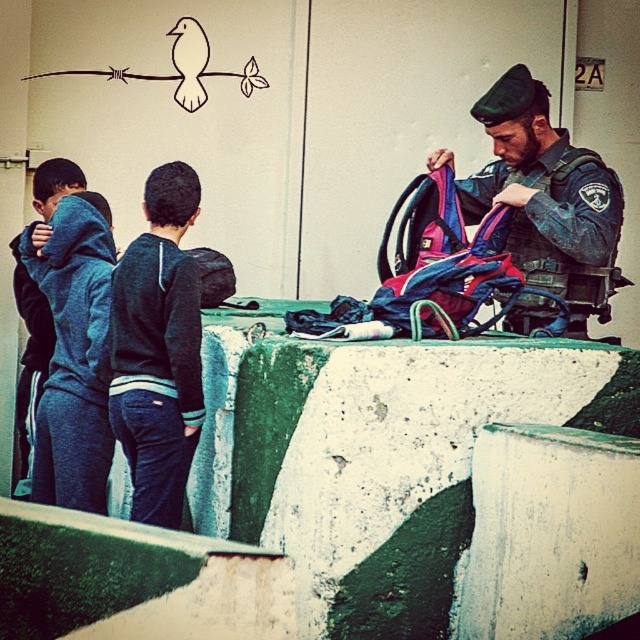
Who is taller, dark gray hoodie at center or dark green uniform at center?

With more height is dark gray hoodie at center.

Is dark gray hoodie at center smaller than dark green uniform at center?

Yes, dark gray hoodie at center is smaller than dark green uniform at center.

Does point (179, 296) come behind point (516, 68)?

No, (179, 296) is closer to viewer.

The image size is (640, 640). Find the location of `dark gray hoodie at center`. dark gray hoodie at center is located at coordinates (157, 349).

Who is positioned more to the right, dark gray hoodie at center or dark blue hoodie at left?

Positioned to the right is dark gray hoodie at center.

Describe the element at coordinates (157, 349) in the screenshot. The height and width of the screenshot is (640, 640). I see `dark gray hoodie at center` at that location.

You are a GUI agent. You are given a task and a screenshot of the screen. Output one action in this format:
    pyautogui.click(x=<x>, y=<y>)
    Task: Click on the dark gray hoodie at center
    The height and width of the screenshot is (640, 640).
    Given the screenshot: What is the action you would take?
    pyautogui.click(x=157, y=349)

Locate an element on the screen. This screenshot has height=640, width=640. dark gray hoodie at center is located at coordinates (157, 349).

Can you confirm if dark green uniform at center is positioned to the left of dark blue hoodie at left?

No, dark green uniform at center is not to the left of dark blue hoodie at left.

Does dark green uniform at center have a lesser height compared to dark blue hoodie at left?

Correct, dark green uniform at center is not as tall as dark blue hoodie at left.

Is point (582, 148) in front of point (67, 300)?

No, it is not.

At what (x,y) coordinates should I click in order to perform the action: click on dark green uniform at center. Please return your answer as a coordinate pair (x, y). Looking at the image, I should click on (541, 186).